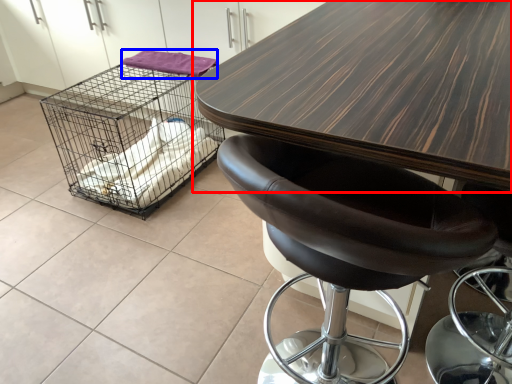
Question: Which object is further to the camera taking this photo, table (highlighted by a red box) or material (highlighted by a blue box)?

Choices:
 (A) table
 (B) material

Answer: (B)